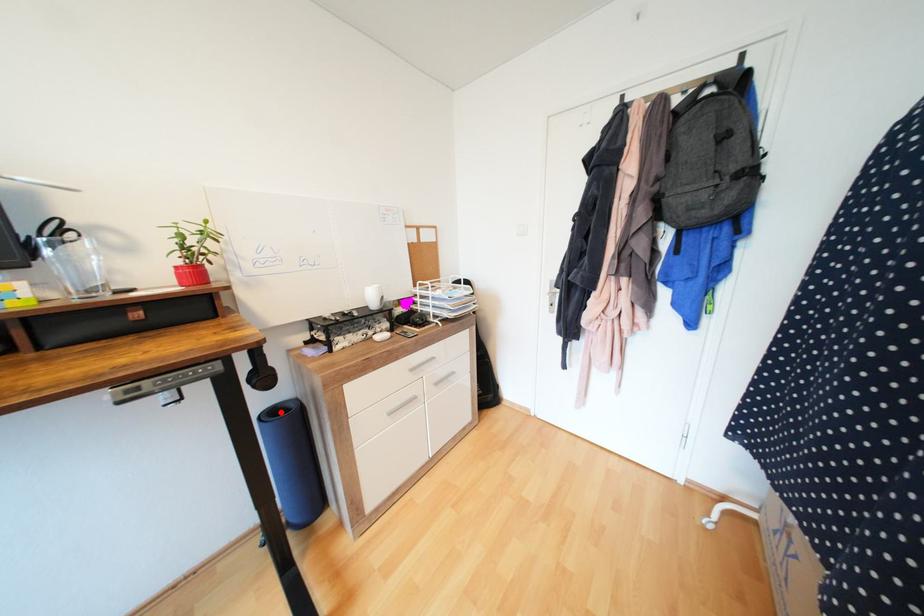
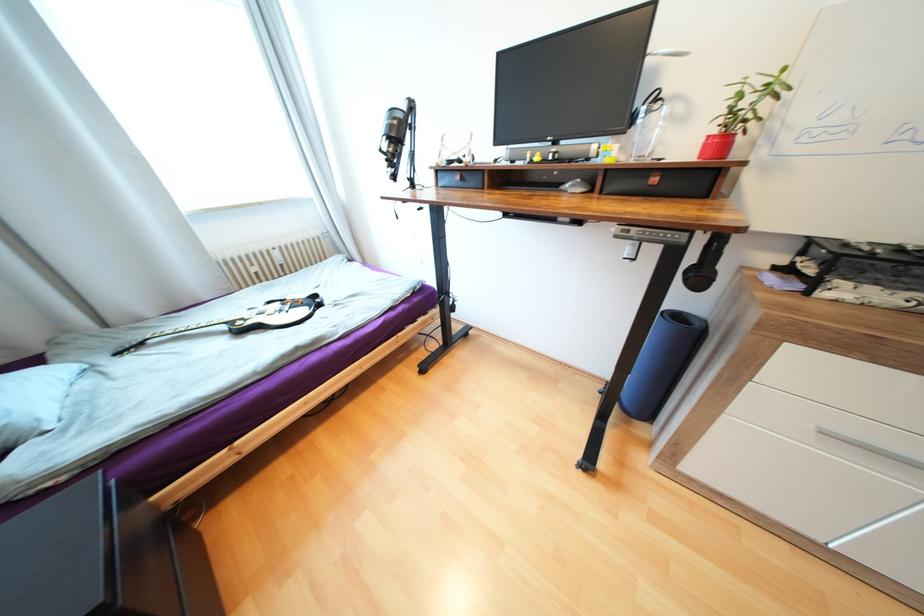
Where in the second image is the point corresponding to the highlighted location from the first image?

(685, 315)